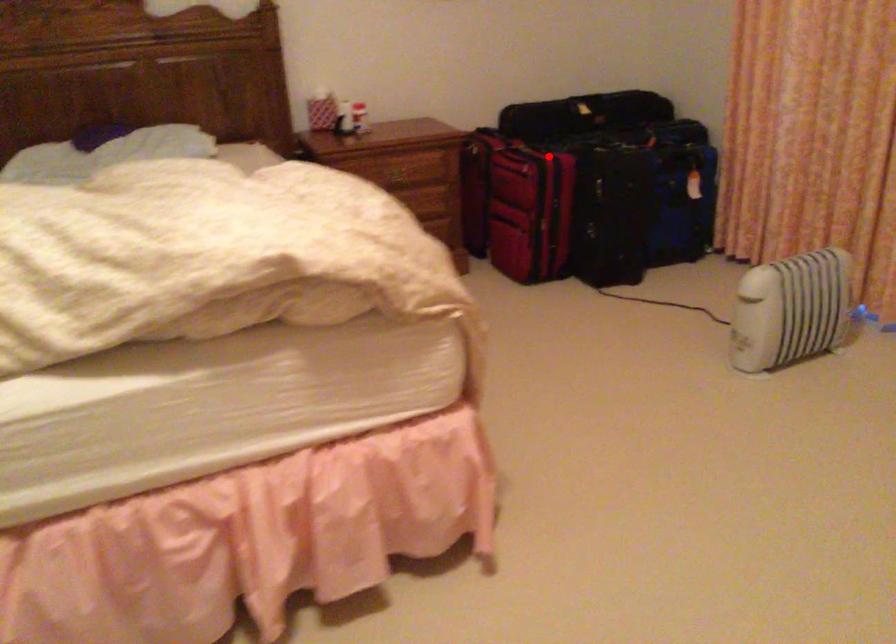
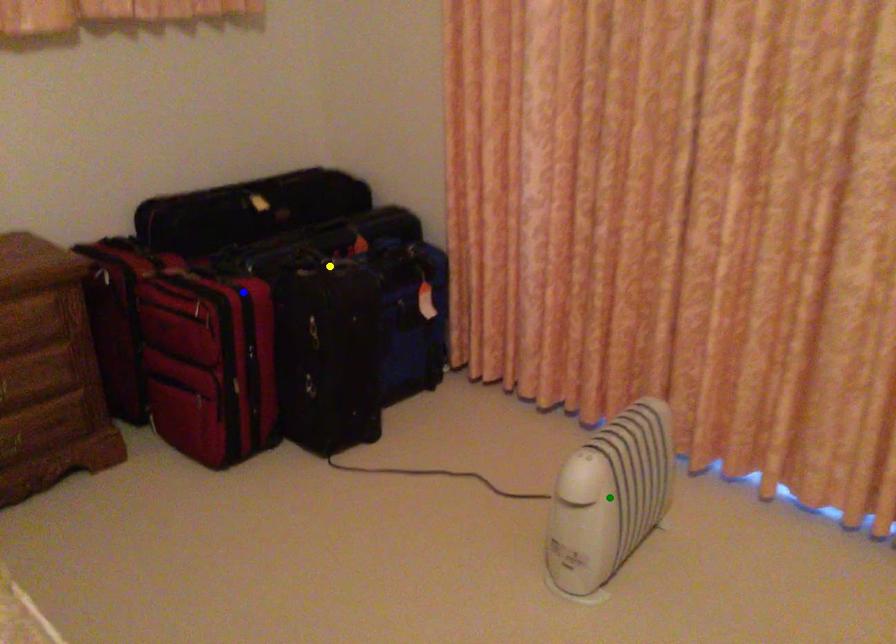
Question: I am providing you with two images of the same scene from different viewpoints. A red point is marked on the first image. You are given multiple points on the second image. In image 2, which mark is for the same physical point as the one in image 1?

Choices:
 (A) green point
 (B) blue point
 (C) yellow point

Answer: (B)